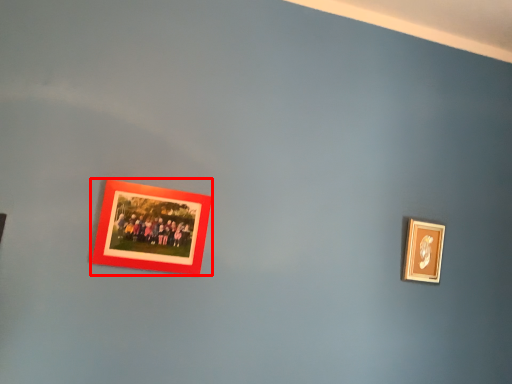
Question: In this image, where is picture frame (annotated by the red box) located relative to picture frame?

Choices:
 (A) right
 (B) left

Answer: (B)